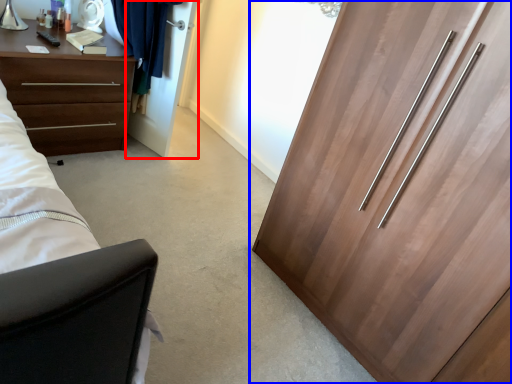
Question: Which point is further to the camera, door (highlighted by a red box) or cupboard (highlighted by a blue box)?

Choices:
 (A) door
 (B) cupboard

Answer: (A)